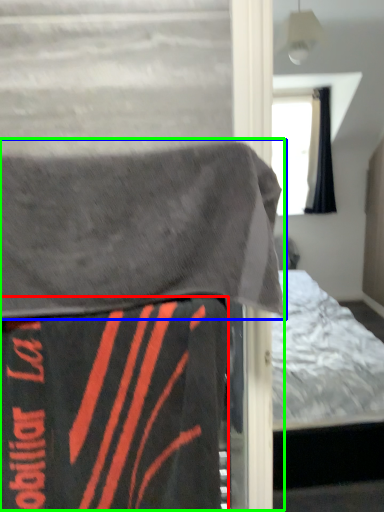
Question: Which object is positioned farthest from blanket (highlighted by a red box)? Select from blanket (highlighted by a blue box) and bed (highlighted by a green box).

Choices:
 (A) blanket
 (B) bed

Answer: (A)